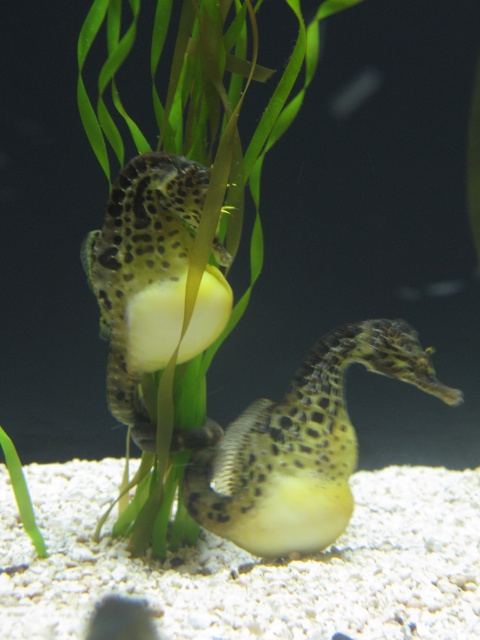
You are an underwater photographer aiming to capture a closeup shot of the green leafy plant at center. Your camera has a fixed focus point at coordinates point (184, 244). Will this point be on the green leafy plant at center?

Yes, the point (184, 244) corresponds to the green leafy plant at center, so the camera focus point will be on the green leafy plant at center.